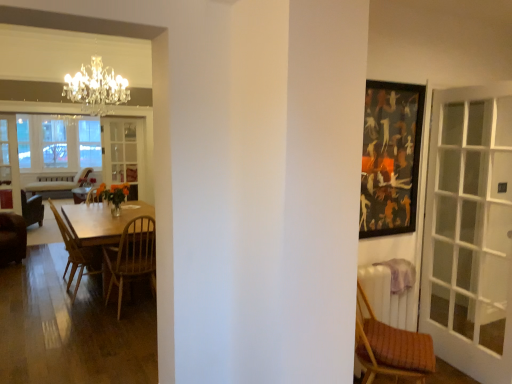
Question: Is clear glass screen door at center, the 2th screen door viewed from the front, turned away from wooden at left, which is the third chair from back to front?

Choices:
 (A) no
 (B) yes

Answer: (A)

Question: Would you consider clear glass screen door at center, the 2th screen door viewed from the front, to be distant from wooden at left, which appears as the 2th chair when viewed from the right?

Choices:
 (A) no
 (B) yes

Answer: (B)

Question: Could you tell me if clear glass screen door at center, placed as the 1th screen door when sorted from right to left, is facing wooden at left, which appears as the 2th chair when viewed from the right?

Choices:
 (A) no
 (B) yes

Answer: (B)

Question: Considering the relative sizes of clear glass screen door at center, the 2th screen door viewed from the front, and wooden at left, which ranks as the second chair in front-to-back order, in the image provided, is clear glass screen door at center, the 2th screen door viewed from the front, bigger than wooden at left, which ranks as the second chair in front-to-back order,?

Choices:
 (A) yes
 (B) no

Answer: (B)

Question: Is wooden at left, which appears as the 2th chair when viewed from the right, located within clear glass screen door at center, the second screen door from the left?

Choices:
 (A) no
 (B) yes

Answer: (A)

Question: In terms of width, does clear glass screen door at left, the second screen door from the back, look wider or thinner when compared to brown leather chair at left, acting as the first chair starting from the left?

Choices:
 (A) thin
 (B) wide

Answer: (A)

Question: Considering their positions, is clear glass screen door at left, marked as the 2th screen door in a right-to-left arrangement, located in front of or behind brown leather chair at left, acting as the 4th chair starting from the right?

Choices:
 (A) front
 (B) behind

Answer: (B)

Question: Is point (17, 188) positioned closer to the camera than point (1, 248)?

Choices:
 (A) closer
 (B) farther

Answer: (B)

Question: From their relative heights in the image, would you say clear glass screen door at left, marked as the 2th screen door in a right-to-left arrangement, is taller or shorter than brown leather chair at left, acting as the 4th chair starting from the right?

Choices:
 (A) tall
 (B) short

Answer: (A)

Question: Which is correct: clear glass screen door at center, acting as the first screen door starting from the back, is inside clear glass screen door at left, acting as the 1th screen door starting from the left, or outside of it?

Choices:
 (A) inside
 (B) outside

Answer: (B)

Question: In the image, is clear glass screen door at center, the 2th screen door viewed from the front, positioned in front of or behind clear glass screen door at left, acting as the 1th screen door starting from the left?

Choices:
 (A) behind
 (B) front

Answer: (A)

Question: Looking at their shapes, would you say clear glass screen door at center, the second screen door from the left, is wider or thinner than clear glass screen door at left, acting as the 1th screen door starting from the left?

Choices:
 (A) wide
 (B) thin

Answer: (A)

Question: In terms of height, does clear glass screen door at center, the second screen door from the left, look taller or shorter compared to clear glass screen door at left, the second screen door from the back?

Choices:
 (A) short
 (B) tall

Answer: (A)

Question: In terms of height, does wooden chair at left, positioned as the 2th chair in back-to-front order, look taller or shorter compared to clear glass screen door at center, the second screen door from the left?

Choices:
 (A) short
 (B) tall

Answer: (A)

Question: Based on their sizes in the image, would you say wooden chair at left, which is counted as the third chair, starting from the right, is bigger or smaller than clear glass screen door at center, acting as the first screen door starting from the back?

Choices:
 (A) big
 (B) small

Answer: (A)